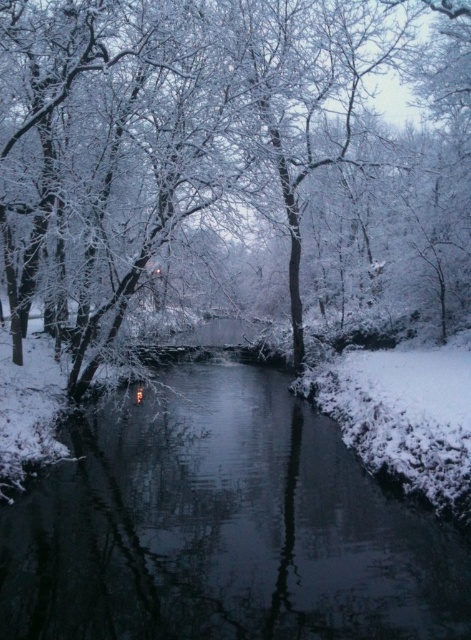
You are a photographer standing at the edge of the river. You want to capture a photo that includes both the white frosty tree at center and the glossy dark water at center. Based on their positions, which object should you focus on first to ensure both are in the frame?

The white frosty tree at center is above the glossy dark water at center, so you should focus on the white frosty tree at center first to ensure both are in the frame.

You are an observer standing at the edge of the river. You see the white frosty tree at center and the glossy dark water at center. Which object is located to the right of the other?

The white frosty tree at center is positioned on the right side of glossy dark water at center.

You are standing at the origin point in the winter scene. There are two points marked in the image, point (186, 4) and point (110, 449). Which point is farther away from you?

Point (186, 4) is behind point (110, 449), so it is farther away from you.